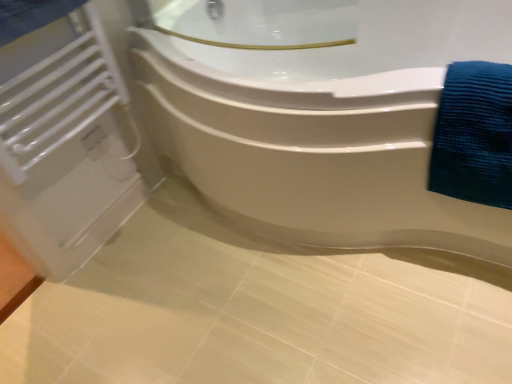
Question: Is white matte radiator at left not within blue textured towel at right?

Choices:
 (A) no
 (B) yes

Answer: (B)

Question: From the image's perspective, is white matte radiator at left located above blue textured towel at right?

Choices:
 (A) yes
 (B) no

Answer: (A)

Question: Could you tell me if white matte radiator at left is facing blue textured towel at right?

Choices:
 (A) yes
 (B) no

Answer: (A)

Question: From the image's perspective, is white matte radiator at left beneath blue textured towel at right?

Choices:
 (A) yes
 (B) no

Answer: (B)

Question: Is white matte radiator at left at the right side of blue textured towel at right?

Choices:
 (A) no
 (B) yes

Answer: (A)

Question: Does white matte radiator at left have a greater width compared to blue textured towel at right?

Choices:
 (A) yes
 (B) no

Answer: (B)

Question: Does blue textured towel at right have a lesser height compared to white matte radiator at left?

Choices:
 (A) no
 (B) yes

Answer: (B)

Question: Could white matte radiator at left be considered to be inside blue textured towel at right?

Choices:
 (A) no
 (B) yes

Answer: (A)

Question: From a real-world perspective, is blue textured towel at right physically below white matte radiator at left?

Choices:
 (A) yes
 (B) no

Answer: (A)

Question: Is blue textured towel at right touching white matte radiator at left?

Choices:
 (A) yes
 (B) no

Answer: (B)

Question: Considering the relative sizes of blue textured towel at right and white matte radiator at left in the image provided, is blue textured towel at right wider than white matte radiator at left?

Choices:
 (A) no
 (B) yes

Answer: (B)

Question: From the image's perspective, would you say blue textured towel at right is shown under white matte radiator at left?

Choices:
 (A) yes
 (B) no

Answer: (A)

Question: Is there a large distance between white glossy bathtub at upper center and white matte radiator at left?

Choices:
 (A) no
 (B) yes

Answer: (A)